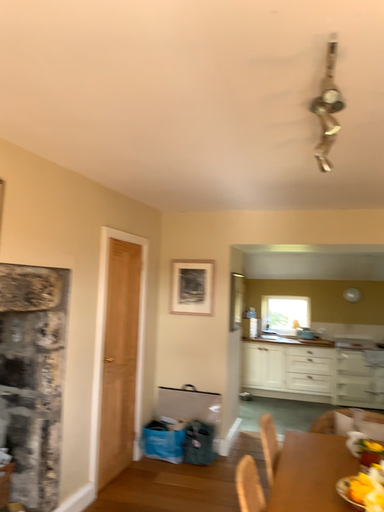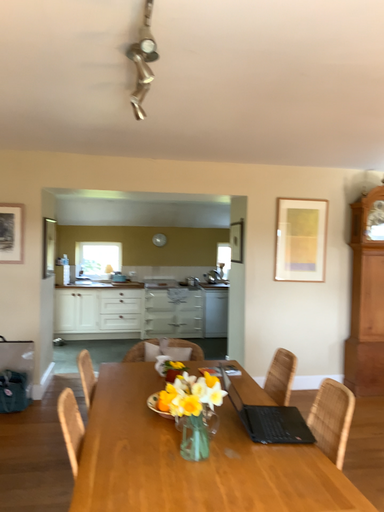
Question: How did the camera likely rotate when shooting the video?

Choices:
 (A) rotated upward
 (B) rotated downward

Answer: (B)